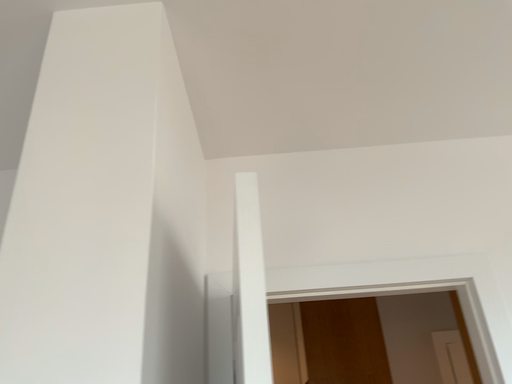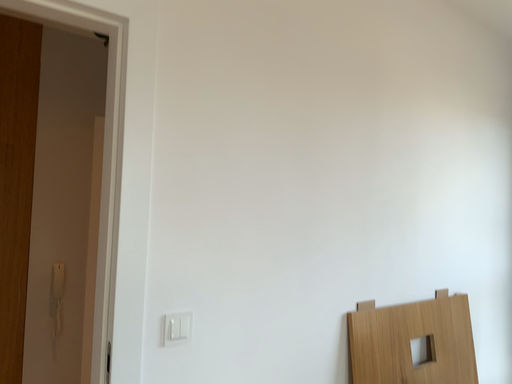
Question: How did the camera likely rotate when shooting the video?

Choices:
 (A) rotated downward
 (B) rotated upward

Answer: (A)